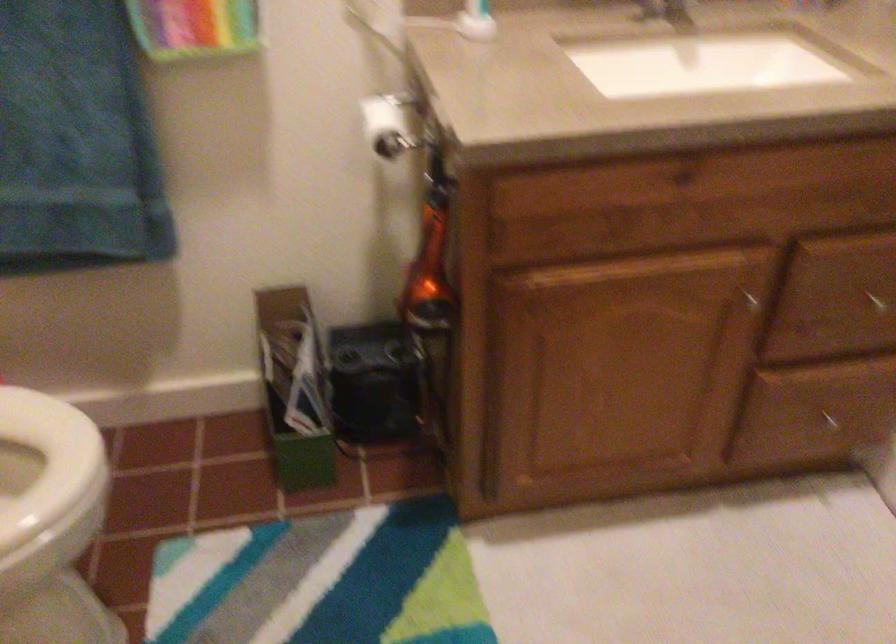
I want to click on orange hair dryer, so click(429, 267).